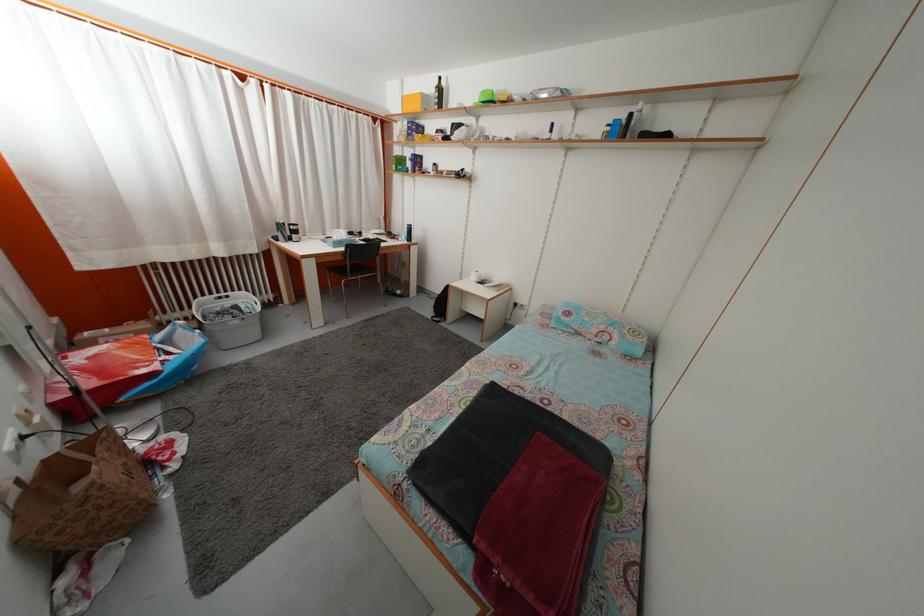
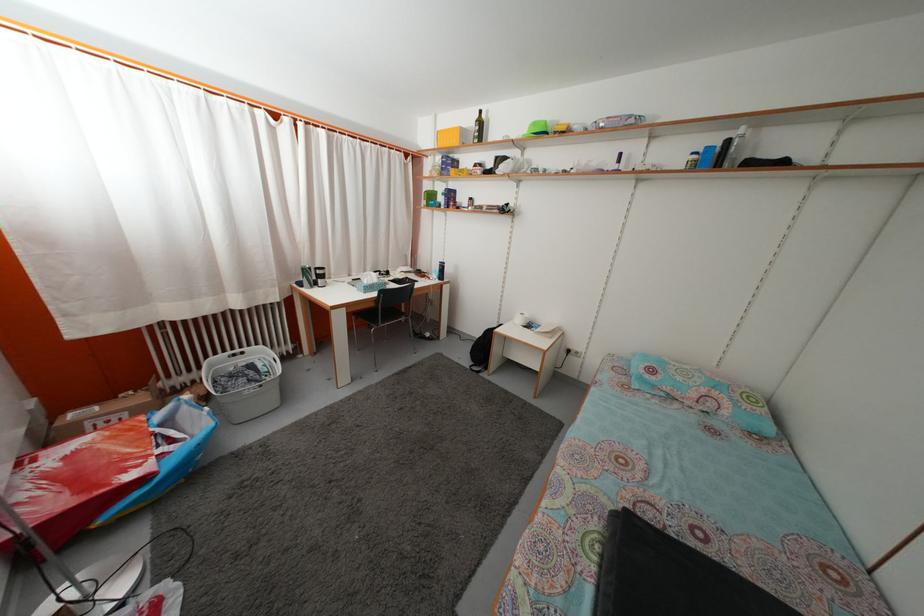
The point at (614, 136) is marked in the first image. Where is the corresponding point in the second image?

(699, 164)